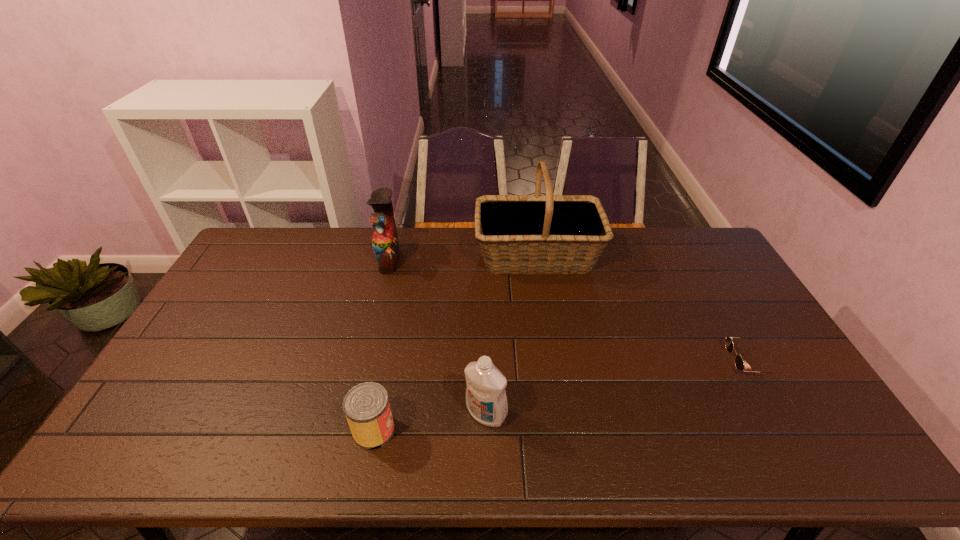
You are a GUI agent. You are given a task and a screenshot of the screen. Output one action in this format:
    pyautogui.click(x=<x>, y=<y>)
    Task: Click on the free space located on the back of the detergent
    The width and height of the screenshot is (960, 540).
    Given the screenshot: What is the action you would take?
    pyautogui.click(x=486, y=334)

Image resolution: width=960 pixels, height=540 pixels. Identify the location of vacant area situated on the back of the fourth tallest object. (384, 380).

Identify the location of free location located on the front lenses of the rightmost object. The image size is (960, 540). (598, 363).

Where is `vacant point located on the front lenses of the rightmost object`? This screenshot has height=540, width=960. vacant point located on the front lenses of the rightmost object is located at coordinates (623, 363).

Find the location of a particular element. The width and height of the screenshot is (960, 540). vacant space situated 0.210m on the front lenses of the rightmost object is located at coordinates (655, 363).

The width and height of the screenshot is (960, 540). Find the location of `basket that is at the far edge`. basket that is at the far edge is located at coordinates (518, 234).

At what (x,y) coordinates should I click in order to perform the action: click on parrot that is positioned at the far edge. Please return your answer as a coordinate pair (x, y). Image resolution: width=960 pixels, height=540 pixels. Looking at the image, I should click on (385, 243).

The image size is (960, 540). Identify the location of object that is at the near edge. (366, 406).

Identify the location of object positioned at the right edge. (739, 363).

Where is `free space at the far edge of the desktop`? free space at the far edge of the desktop is located at coordinates (424, 240).